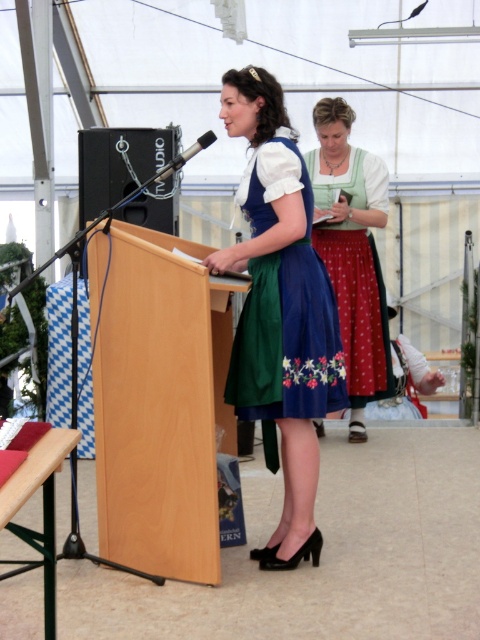
Does matte blue dress at center lie in front of black matte speaker at center?

Yes, it is in front of black matte speaker at center.

Is matte blue dress at center shorter than black matte speaker at center?

No, matte blue dress at center is not shorter than black matte speaker at center.

Is point (267, 560) farther from viewer compared to point (132, 147)?

No, it is not.

Identify the location of matte blue dress at center. (279, 310).

Is matte blue dress at center closer to camera compared to green satin dirndl at center?

Yes, it is.

Does matte blue dress at center have a greater height compared to green satin dirndl at center?

No.

Is point (335, 392) in front of point (376, 180)?

Yes, point (335, 392) is closer to viewer.

Identify the location of matte blue dress at center. (279, 310).

Between blue satin dirndl at center and green satin dirndl at center, which one is positioned lower?

blue satin dirndl at center is below.

Image resolution: width=480 pixels, height=640 pixels. What do you see at coordinates (288, 332) in the screenshot?
I see `blue satin dirndl at center` at bounding box center [288, 332].

Where is `blue satin dirndl at center`? This screenshot has width=480, height=640. blue satin dirndl at center is located at coordinates (288, 332).